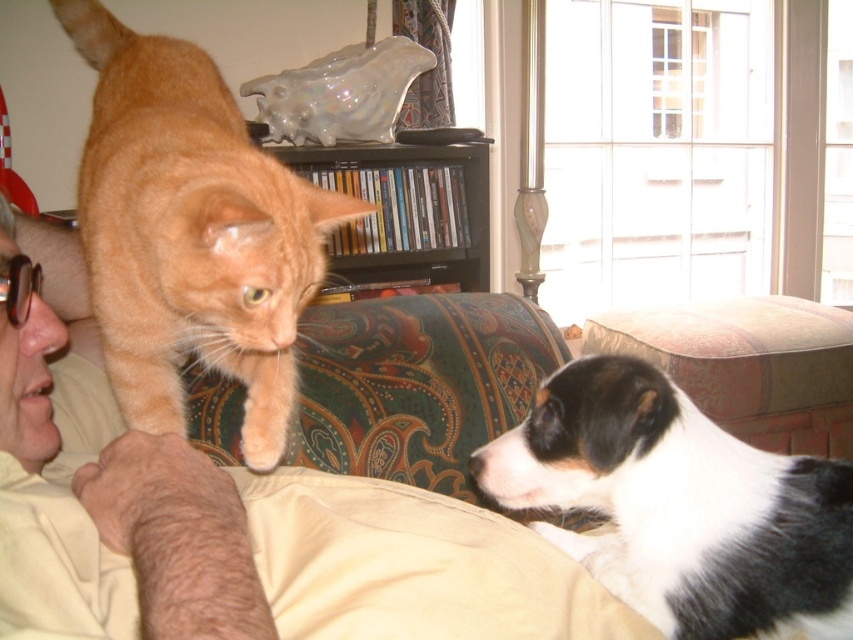
Question: Is the position of beige cotton shirt at upper left more distant than that of orange fur cat at upper left?

Choices:
 (A) no
 (B) yes

Answer: (A)

Question: Which object appears farthest from the camera in this image?

Choices:
 (A) beige cotton shirt at upper left
 (B) orange fur cat at upper left
 (C) black and white fur at lower right
 (D) black glossy bookshelf at upper center

Answer: (D)

Question: Which object is the farthest from the beige cotton shirt at upper left?

Choices:
 (A) black and white fur at lower right
 (B) orange fur cat at upper left
 (C) black glossy bookshelf at upper center

Answer: (C)

Question: Among these points, which one is farthest from the camera?

Choices:
 (A) (583, 397)
 (B) (318, 193)
 (C) (447, 147)
 (D) (38, 632)

Answer: (C)

Question: Does black and white fur at lower right lie behind black glossy bookshelf at upper center?

Choices:
 (A) yes
 (B) no

Answer: (B)

Question: Is beige cotton shirt at upper left bigger than black and white fur at lower right?

Choices:
 (A) no
 (B) yes

Answer: (B)